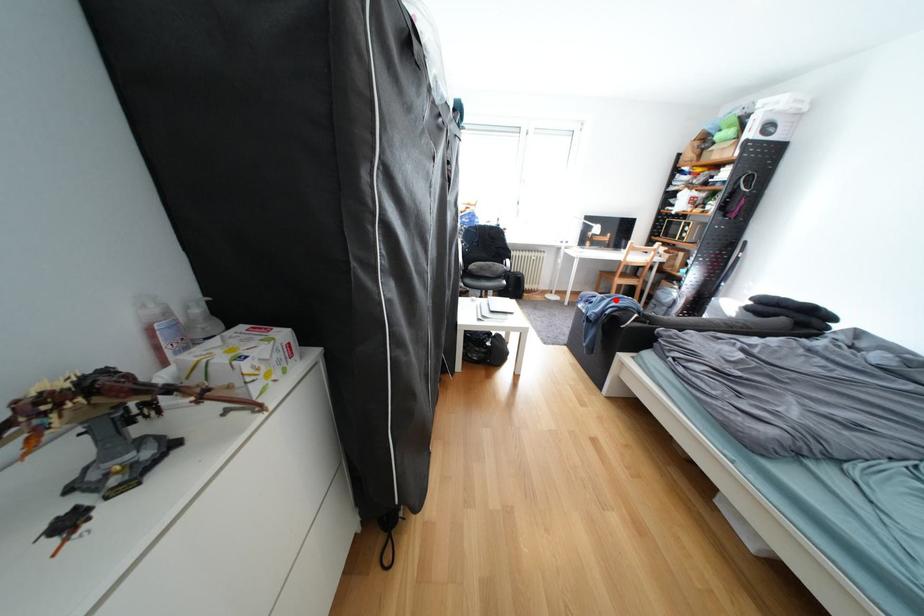
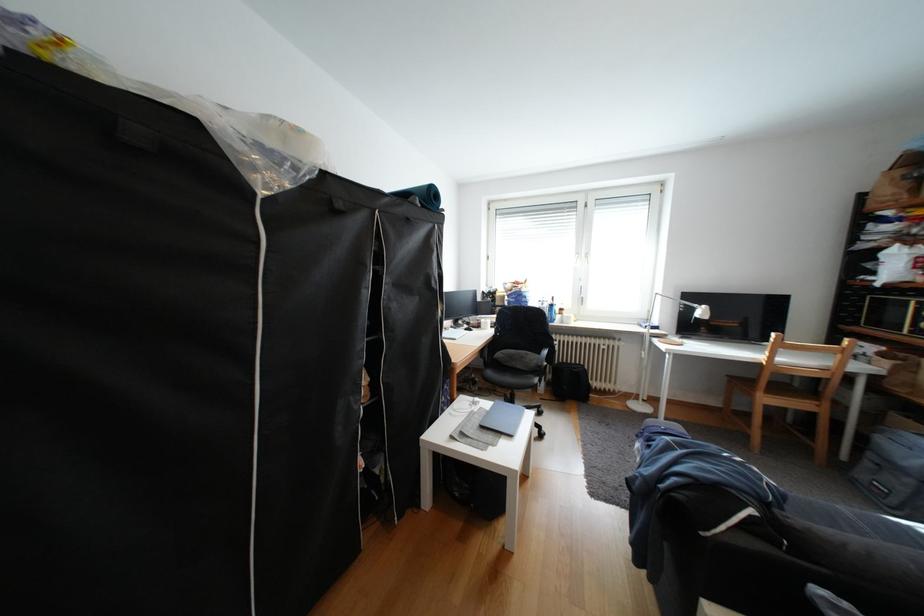
Question: I am providing you with two images of the same scene from different viewpoints. A red point is marked on the first image. At the location where the point appears in image 1, is it still visible in image 2?

Choices:
 (A) Yes
 (B) No

Answer: (A)